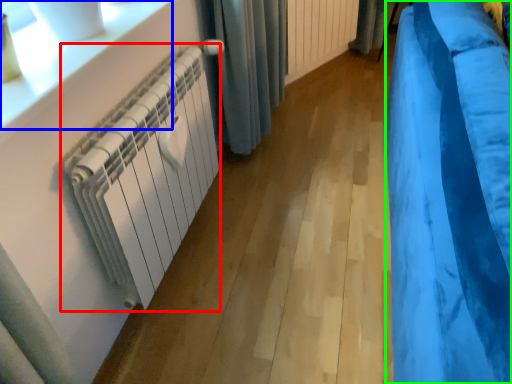
Question: Which is farther away from radiator (highlighted by a red box)? window sill (highlighted by a blue box) or curtain (highlighted by a green box)?

Choices:
 (A) window sill
 (B) curtain

Answer: (B)